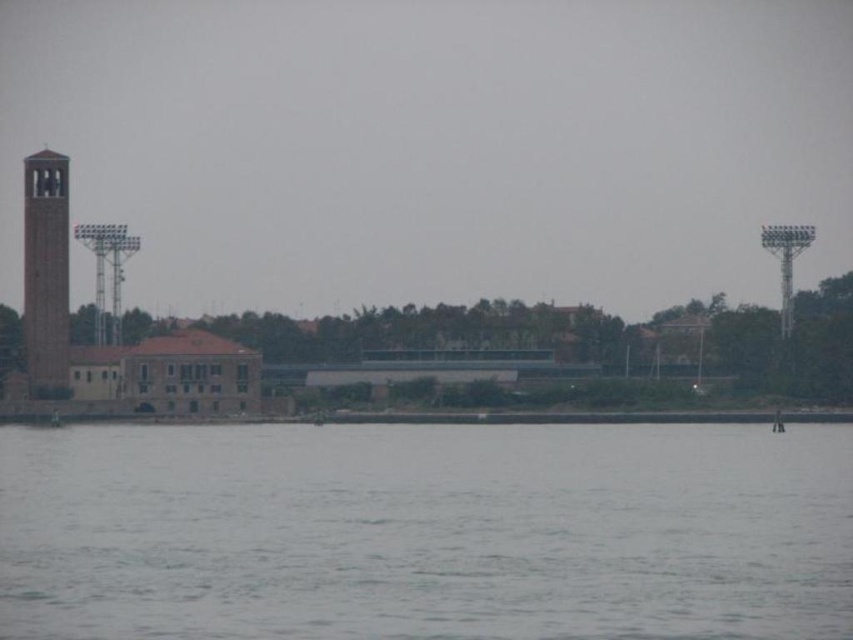
Question: Can you confirm if gray water at lower center is wider than smooth stone bell tower at left?

Choices:
 (A) no
 (B) yes

Answer: (B)

Question: Is gray water at lower center to the left of smooth stone bell tower at left from the viewer's perspective?

Choices:
 (A) yes
 (B) no

Answer: (B)

Question: Is gray water at lower center below smooth stone bell tower at left?

Choices:
 (A) yes
 (B) no

Answer: (A)